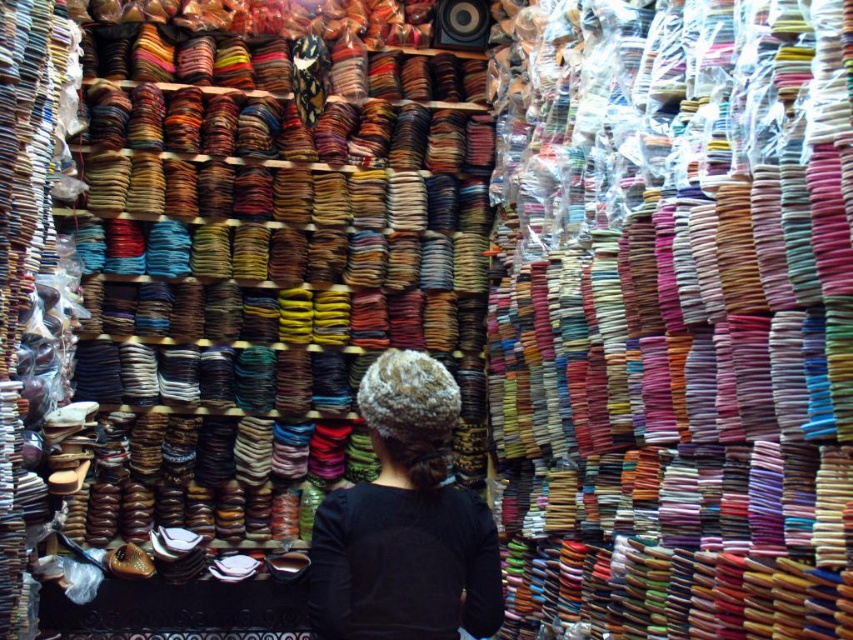
Can you confirm if shiny plastic bangles at center is positioned below black matte hair at center?

Actually, shiny plastic bangles at center is above black matte hair at center.

Is shiny plastic bangles at center above black matte hair at center?

Correct, shiny plastic bangles at center is located above black matte hair at center.

At what (x,y) coordinates should I click in order to perform the action: click on shiny plastic bangles at center. Please return your answer as a coordinate pair (x, y). Looking at the image, I should click on (672, 316).